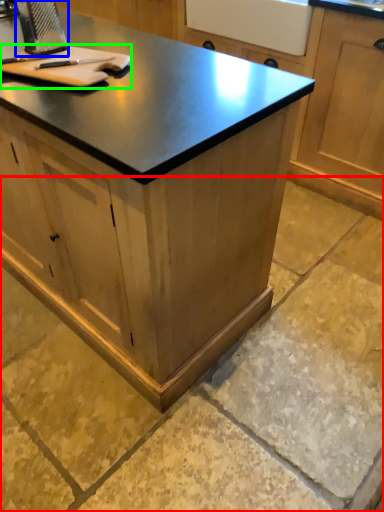
Question: Based on their relative distances, which object is nearer to concrete (highlighted by a red box)? Choose from appliance (highlighted by a blue box) and cutting board (highlighted by a green box).

Choices:
 (A) appliance
 (B) cutting board

Answer: (B)